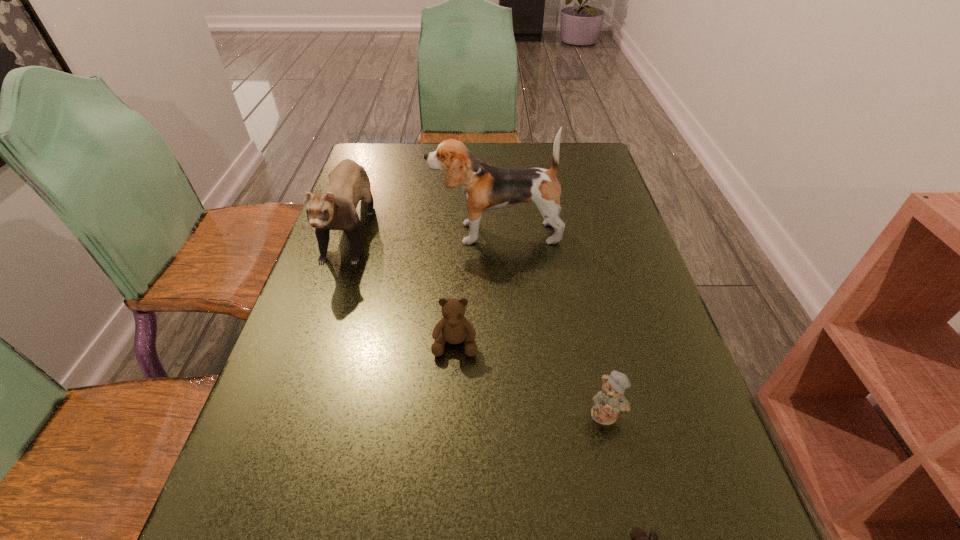
Find the location of a particular element. vacant region between the leftmost teddy bear and the tallest object is located at coordinates (475, 288).

The image size is (960, 540). What are the coordinates of `free space that is in between the second nearest object and the ferret` in the screenshot? It's located at (479, 319).

You are a GUI agent. You are given a task and a screenshot of the screen. Output one action in this format:
    pyautogui.click(x=<x>, y=<y>)
    Task: Click on the vacant area between the third farthest object and the second farthest teddy bear
    The width and height of the screenshot is (960, 540).
    Given the screenshot: What is the action you would take?
    pyautogui.click(x=531, y=378)

Find the location of a particular element. vacant area between the fourth shortest object and the second nearest object is located at coordinates (479, 319).

Image resolution: width=960 pixels, height=540 pixels. In order to click on vacant area that lies between the second nearest teddy bear and the tallest object in this screenshot , I will do `click(551, 323)`.

You are a GUI agent. You are given a task and a screenshot of the screen. Output one action in this format:
    pyautogui.click(x=<x>, y=<y>)
    Task: Click on the fourth closest object relative to the second nearest object
    The width and height of the screenshot is (960, 540).
    Given the screenshot: What is the action you would take?
    pyautogui.click(x=348, y=182)

Image resolution: width=960 pixels, height=540 pixels. I want to click on object that ranks as the third closest to the tallest object, so click(610, 401).

Select which teddy bear appears as the second closest to the ferret. Please provide its 2D coordinates. Your answer should be formatted as a tuple, i.e. [(x, y)], where the tuple contains the x and y coordinates of a point satisfying the conditions above.

[(610, 401)]

You are a GUI agent. You are given a task and a screenshot of the screen. Output one action in this format:
    pyautogui.click(x=<x>, y=<y>)
    Task: Click on the teddy bear that is the second nearest to the second farthest teddy bear
    The width and height of the screenshot is (960, 540).
    Given the screenshot: What is the action you would take?
    pyautogui.click(x=454, y=328)

You are a GUI agent. You are given a task and a screenshot of the screen. Output one action in this format:
    pyautogui.click(x=<x>, y=<y>)
    Task: Click on the free space that satisfies the following two spatial constraints: 1. at the face of the puppy; 2. on the front-facing side of the leftmost teddy bear
    
    Given the screenshot: What is the action you would take?
    pyautogui.click(x=500, y=342)